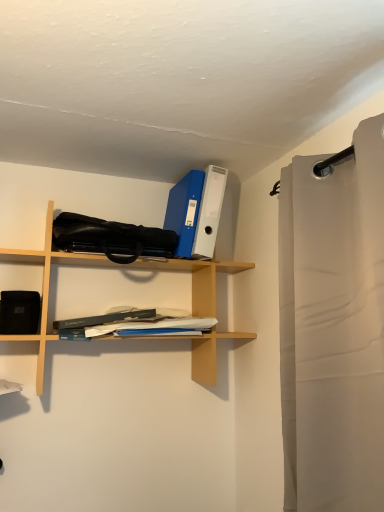
Question: Does black matte speaker at left lie behind light beige fabric shower curtain at right?

Choices:
 (A) yes
 (B) no

Answer: (A)

Question: Would you say light beige fabric shower curtain at right is part of black matte speaker at left's contents?

Choices:
 (A) yes
 (B) no

Answer: (B)

Question: Is black matte speaker at left directly adjacent to light beige fabric shower curtain at right?

Choices:
 (A) yes
 (B) no

Answer: (B)

Question: Can you confirm if black matte speaker at left is wider than light beige fabric shower curtain at right?

Choices:
 (A) no
 (B) yes

Answer: (A)

Question: Considering the relative sizes of black matte speaker at left and light beige fabric shower curtain at right in the image provided, is black matte speaker at left shorter than light beige fabric shower curtain at right?

Choices:
 (A) yes
 (B) no

Answer: (A)

Question: Do you think wooden shelf at upper center is within light beige fabric shower curtain at right, or outside of it?

Choices:
 (A) outside
 (B) inside

Answer: (A)

Question: Is wooden shelf at upper center wider or thinner than light beige fabric shower curtain at right?

Choices:
 (A) wide
 (B) thin

Answer: (A)

Question: Relative to light beige fabric shower curtain at right, is wooden shelf at upper center in front or behind?

Choices:
 (A) front
 (B) behind

Answer: (B)

Question: In the image, is wooden shelf at upper center on the left side or the right side of light beige fabric shower curtain at right?

Choices:
 (A) right
 (B) left

Answer: (B)

Question: Visually, is wooden shelf at upper center positioned to the left or to the right of white paper at center?

Choices:
 (A) right
 (B) left

Answer: (B)

Question: Choose the correct answer: Is wooden shelf at upper center inside white paper at center or outside it?

Choices:
 (A) outside
 (B) inside

Answer: (A)

Question: From the image's perspective, relative to white paper at center, is wooden shelf at upper center above or below?

Choices:
 (A) above
 (B) below

Answer: (A)

Question: Is wooden shelf at upper center taller or shorter than white paper at center?

Choices:
 (A) tall
 (B) short

Answer: (A)

Question: From a real-world perspective, is white paper at center above or below black matte speaker at left?

Choices:
 (A) below
 (B) above

Answer: (A)

Question: Is point (77, 326) positioned closer to the camera than point (31, 302)?

Choices:
 (A) closer
 (B) farther

Answer: (B)